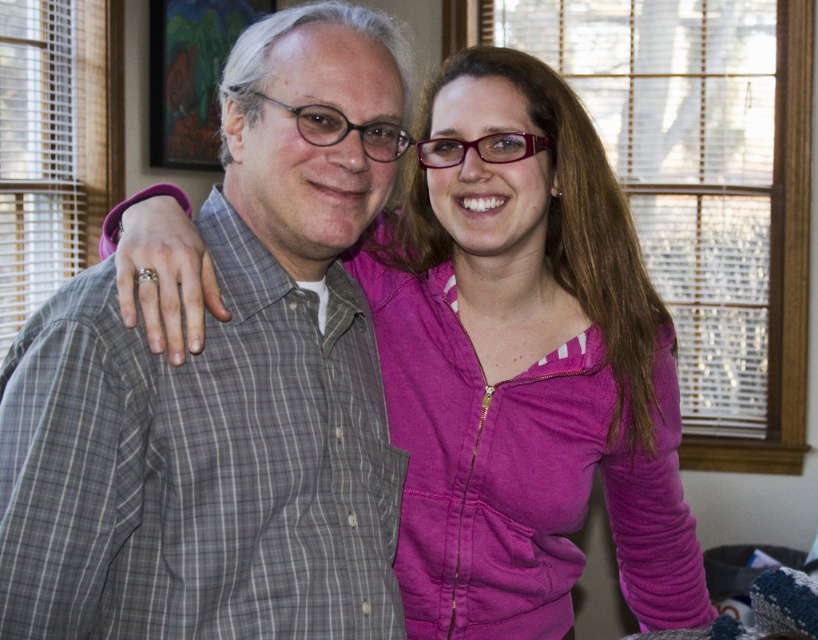
Question: Does gray plaid shirt at center appear on the left side of purple zip-up hoodie at center?

Choices:
 (A) no
 (B) yes

Answer: (B)

Question: From the image, what is the correct spatial relationship of gray plaid shirt at center in relation to purple zip-up hoodie at center?

Choices:
 (A) above
 (B) below

Answer: (A)

Question: Can you confirm if gray plaid shirt at center is bigger than purple zip-up hoodie at center?

Choices:
 (A) yes
 (B) no

Answer: (B)

Question: Which point is farther to the camera?

Choices:
 (A) purple zip-up hoodie at center
 (B) gray plaid shirt at center

Answer: (A)

Question: Which object is closer to the camera taking this photo?

Choices:
 (A) gray plaid shirt at center
 (B) purple zip-up hoodie at center

Answer: (A)